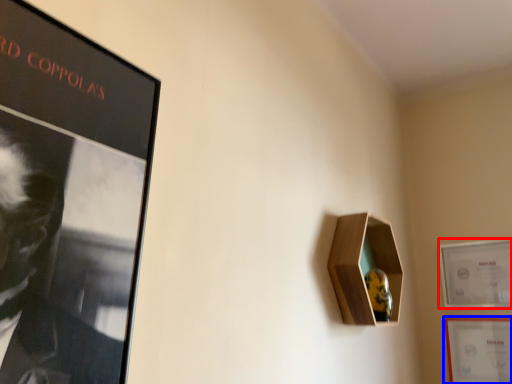
Question: Among these objects, which one is farthest to the camera, picture frame (highlighted by a red box) or picture frame (highlighted by a blue box)?

Choices:
 (A) picture frame
 (B) picture frame

Answer: (A)